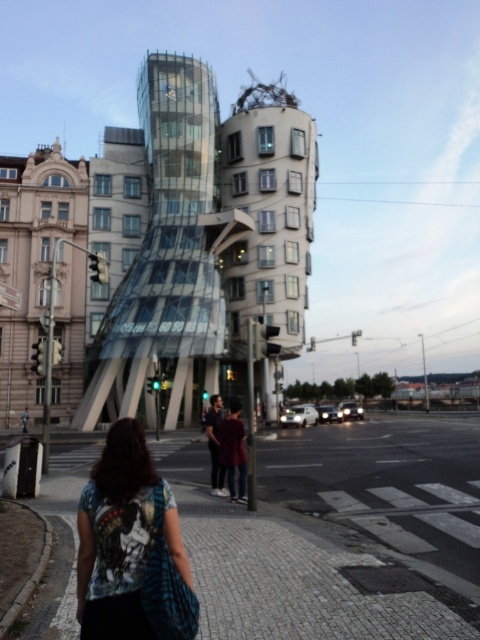
Question: Where is paved stone at center located in relation to matte beige building at left in the image?

Choices:
 (A) below
 (B) above

Answer: (A)

Question: Does transparent glass building at center appear over blue printed t-shirt at lower left?

Choices:
 (A) yes
 (B) no

Answer: (A)

Question: Based on their relative distances, which object is nearer to the transparent glass building at center?

Choices:
 (A) matte beige building at left
 (B) blue printed t-shirt at lower left
 (C) paved stone at center

Answer: (A)

Question: Which point appears closest to the camera in this image?

Choices:
 (A) 130,456
 (B) 228,625

Answer: (A)

Question: Does paved stone at center have a greater width compared to blue printed t-shirt at lower left?

Choices:
 (A) yes
 (B) no

Answer: (A)

Question: Considering the real-world distances, which object is closest to the matte beige building at left?

Choices:
 (A) paved stone at center
 (B) blue printed t-shirt at lower left

Answer: (A)